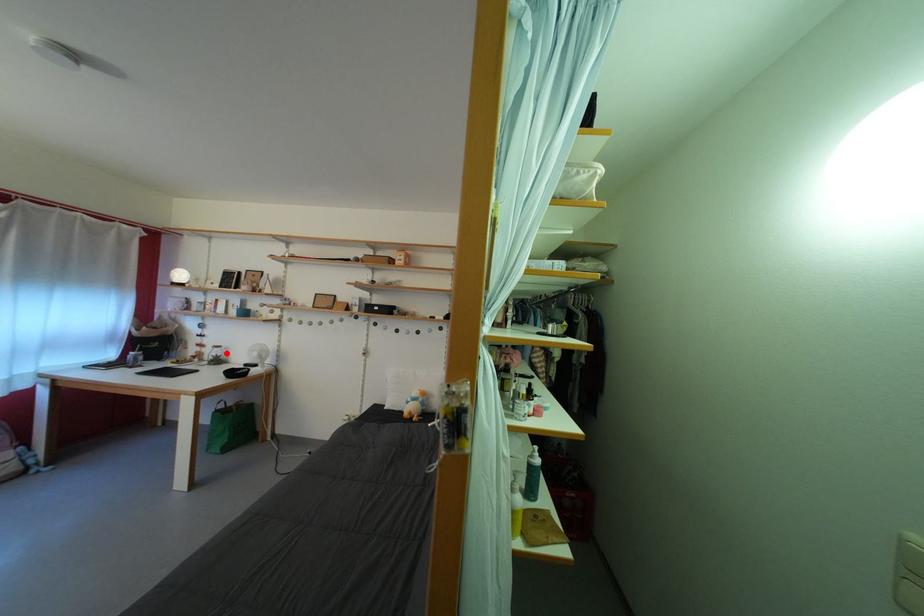
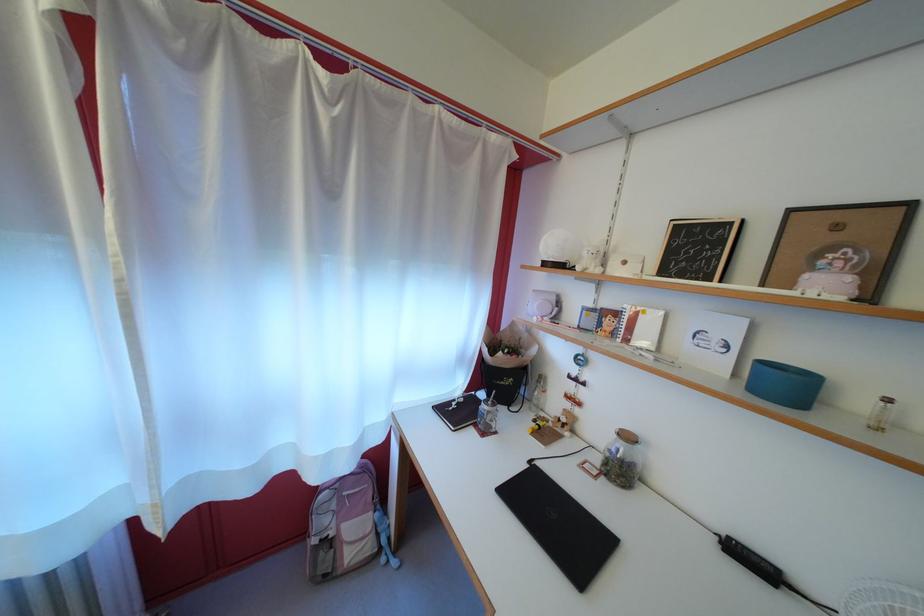
The point at the highlighted location is marked in the first image. Where is the corresponding point in the second image?

(637, 444)